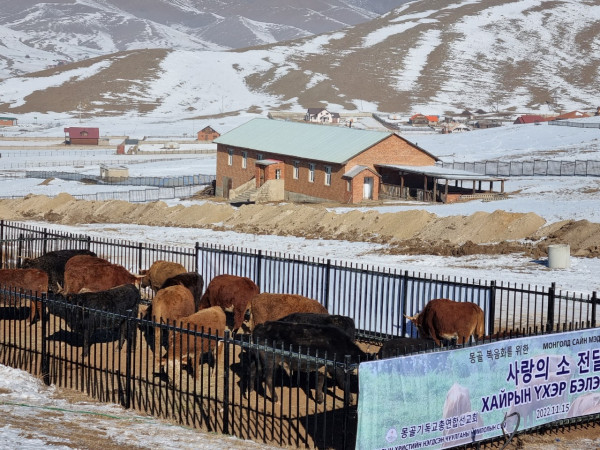
Where is `windows`? This screenshot has width=600, height=450. windows is located at coordinates (331, 178), (311, 178), (298, 177), (258, 158), (241, 160), (234, 159).